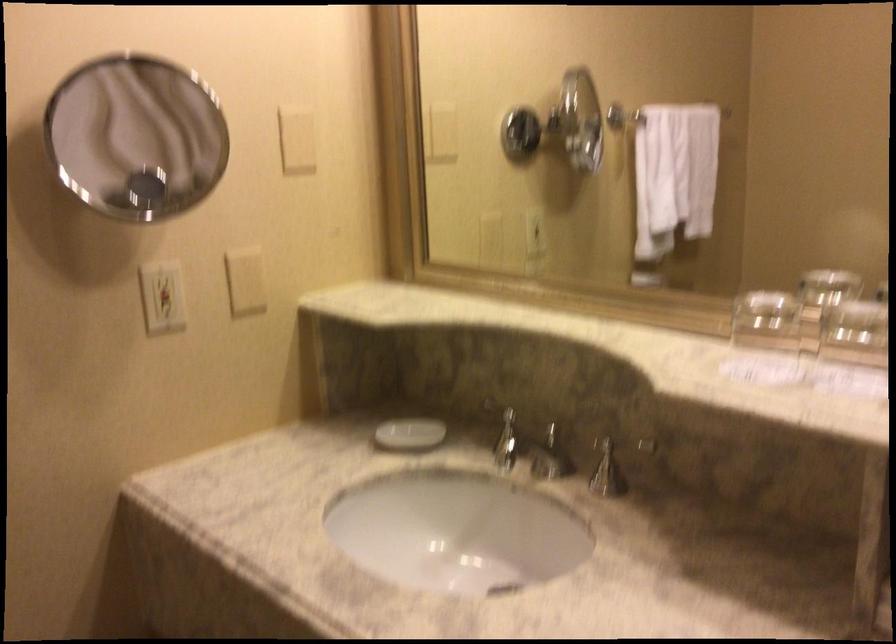
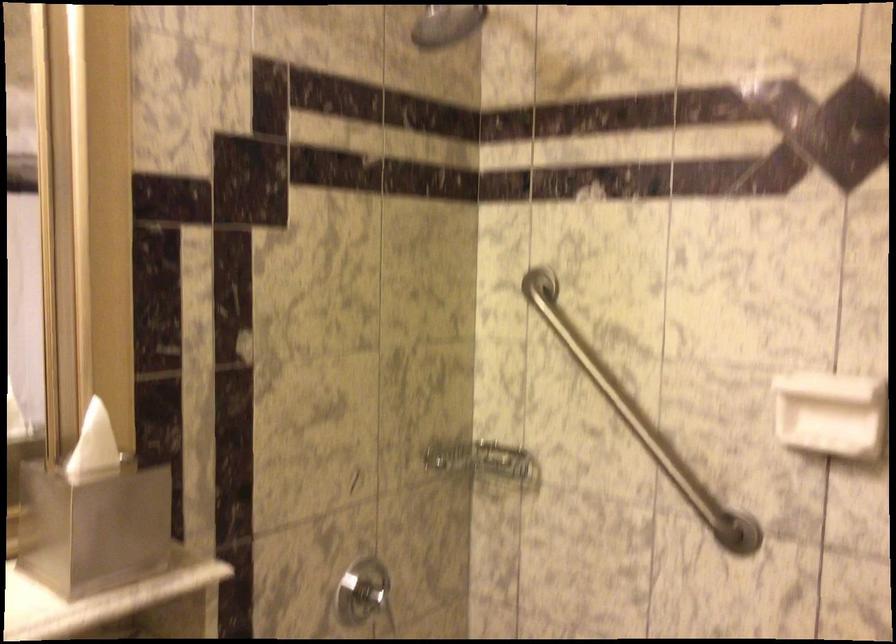
Question: The camera is either moving clockwise (left) or counter-clockwise (right) around the object. The first image is from the beginning of the video and the second image is from the end. Is the camera moving left or right when shooting the video?

Choices:
 (A) Left
 (B) Right

Answer: (A)